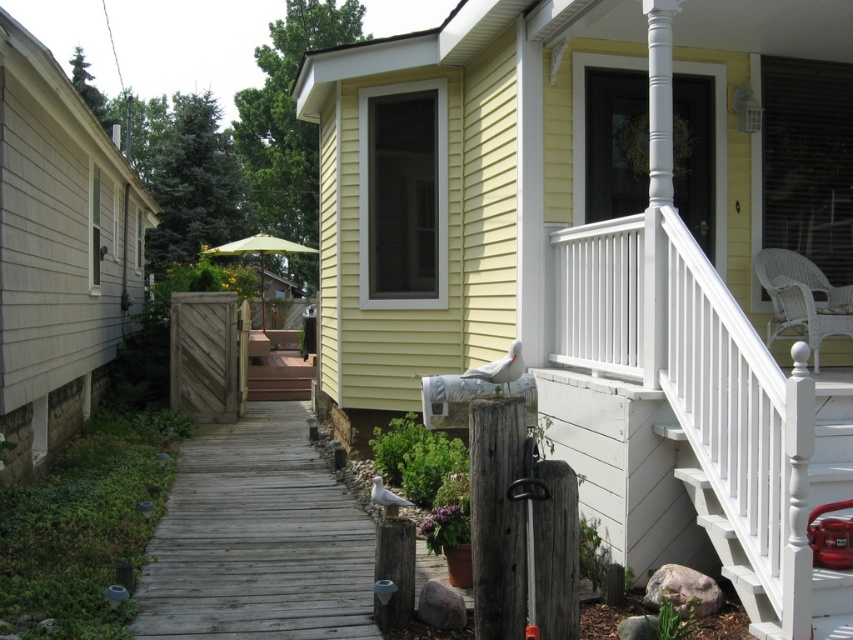
Question: From the image, what is the correct spatial relationship of white painted wood rail at upper right in relation to weathered wood deck at center?

Choices:
 (A) left
 (B) right

Answer: (B)

Question: Is weathered wood deck at center below green fabric umbrella at center?

Choices:
 (A) yes
 (B) no

Answer: (A)

Question: Which of the following is the farthest from the observer?

Choices:
 (A) weathered wood deck at center
 (B) weathered wood post at center

Answer: (A)

Question: Among these objects, which one is farthest from the camera?

Choices:
 (A) weathered wood deck at center
 (B) white painted wood rail at upper right
 (C) weathered wood post at center
 (D) white painted wood stairs at upper right

Answer: (A)

Question: Which point appears farthest from the camera in this image?

Choices:
 (A) (285, 472)
 (B) (469, 496)

Answer: (A)

Question: Does weathered wood post at center appear under green fabric umbrella at center?

Choices:
 (A) no
 (B) yes

Answer: (B)